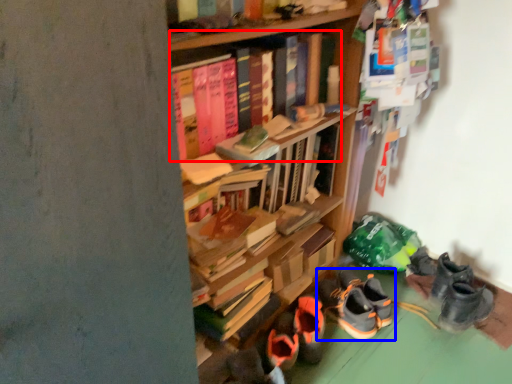
Question: Which object is further to the camera taking this photo, book (highlighted by a red box) or footwear (highlighted by a blue box)?

Choices:
 (A) book
 (B) footwear

Answer: (B)